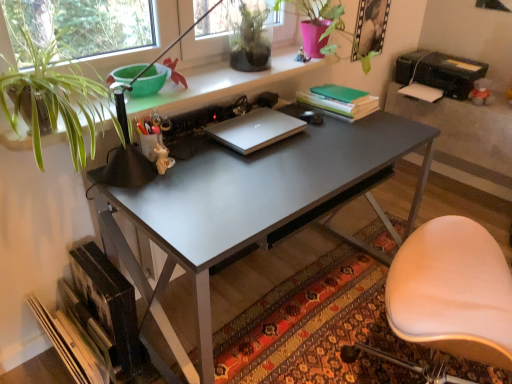
This screenshot has width=512, height=384. In order to click on vacant space in front of silver metallic laptop at center in this screenshot , I will do `click(257, 166)`.